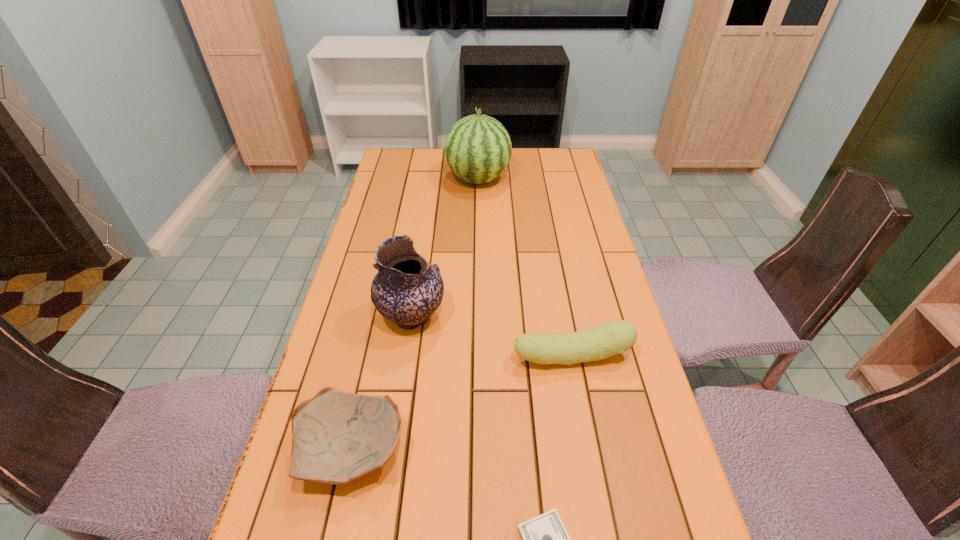
At what (x,y) coordinates should I click in order to perform the action: click on free space that is in between the farthest object and the third shortest object. Please return your answer as a coordinate pair (x, y). The height and width of the screenshot is (540, 960). Looking at the image, I should click on (524, 268).

Find the location of a particular element. empty space between the third shortest object and the farthest object is located at coordinates (524, 268).

You are a GUI agent. You are given a task and a screenshot of the screen. Output one action in this format:
    pyautogui.click(x=<x>, y=<y>)
    Task: Click on the object that can be found as the closest to the tallest object
    
    Given the screenshot: What is the action you would take?
    pyautogui.click(x=407, y=290)

The height and width of the screenshot is (540, 960). Identify the location of object that is the fourth closest one to the cucumber. (478, 148).

The height and width of the screenshot is (540, 960). Find the location of `free space that satisfies the following two spatial constraints: 1. on the back side of the tallest object; 2. on the left side of the fourth shortest object`. free space that satisfies the following two spatial constraints: 1. on the back side of the tallest object; 2. on the left side of the fourth shortest object is located at coordinates (433, 179).

I want to click on vacant space that satisfies the following two spatial constraints: 1. on the back side of the fourth shortest object; 2. on the right side of the second shortest object, so click(381, 317).